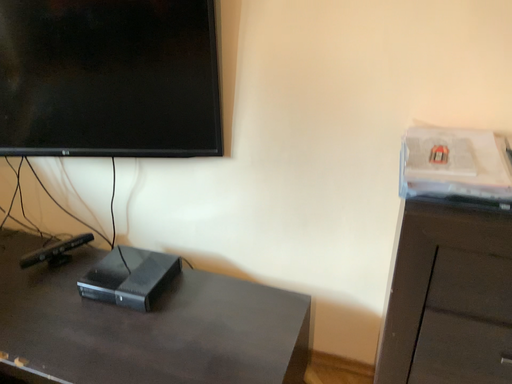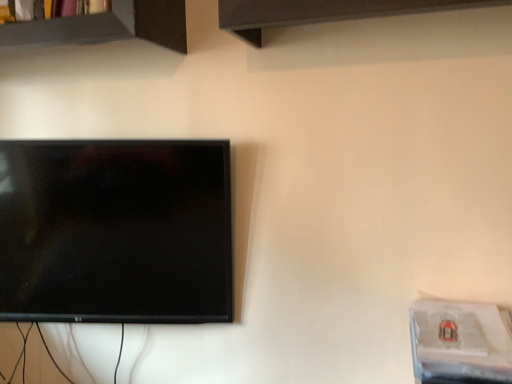
Question: Which way did the camera rotate in the video?

Choices:
 (A) rotated upward
 (B) rotated downward

Answer: (A)